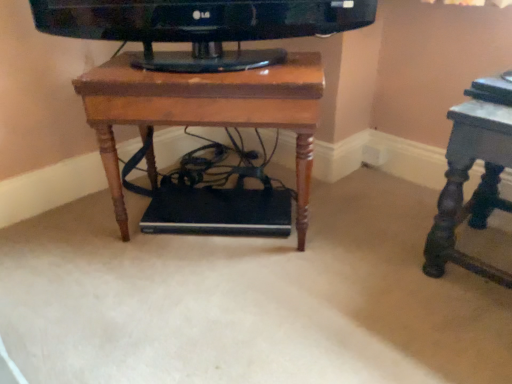
The height and width of the screenshot is (384, 512). Find the location of `free space that is in between wooden table at center, arranged as the first table when viewed from the left, and dark gray polished wood table at right, which is counted as the second table, starting from the left`. free space that is in between wooden table at center, arranged as the first table when viewed from the left, and dark gray polished wood table at right, which is counted as the second table, starting from the left is located at coordinates (355, 239).